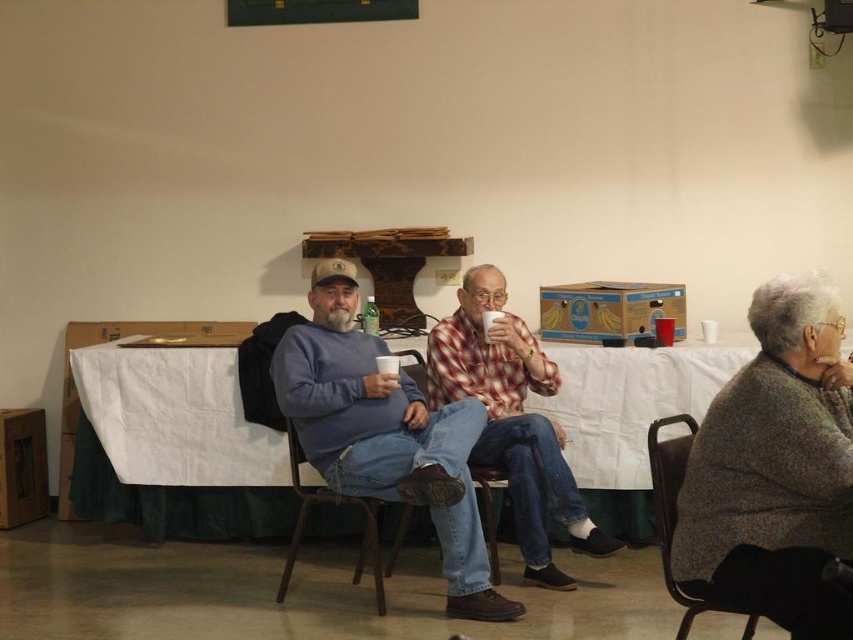
You are trying to decide which article of clothing to grab first from the group of people seated. The matte blue sweater at center and the plaid fabric shirt at center are both visible. Which one is closer to you?

The matte blue sweater at center is positioned under the plaid fabric shirt at center, meaning it is closer to you since it is underneath.

From the picture: You are standing at the point labeled as point (x=488, y=486) and want to move towards the point labeled as point (x=662, y=538). Which direction should you move to reach there?

To move from point (x=488, y=486) to point (x=662, y=538), you should move forward since point (x=662, y=538) is in front of point (x=488, y=486).